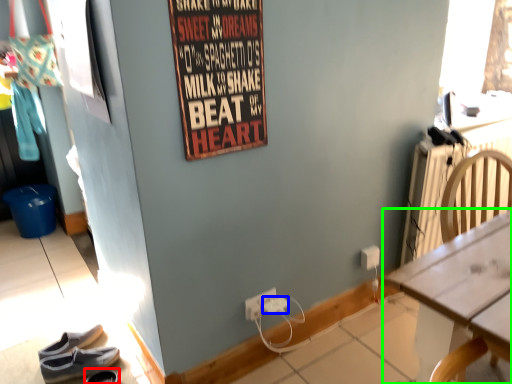
Question: Estimate the real-world distances between objects in this image. Which object is closer to footwear (highlighted by a red box), power outlet (highlighted by a blue box) or desk (highlighted by a green box)?

Choices:
 (A) power outlet
 (B) desk

Answer: (A)